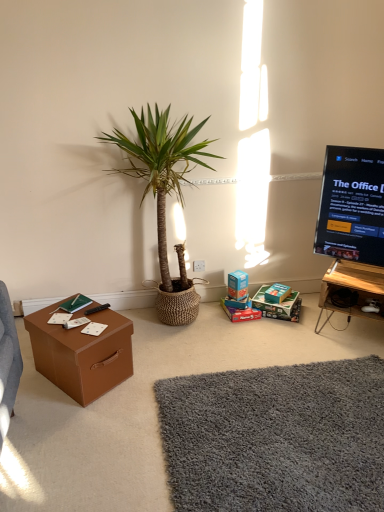
Identify the location of vacant area on top of wooden entertainment center at right (from a real-world perspective). (359, 277).